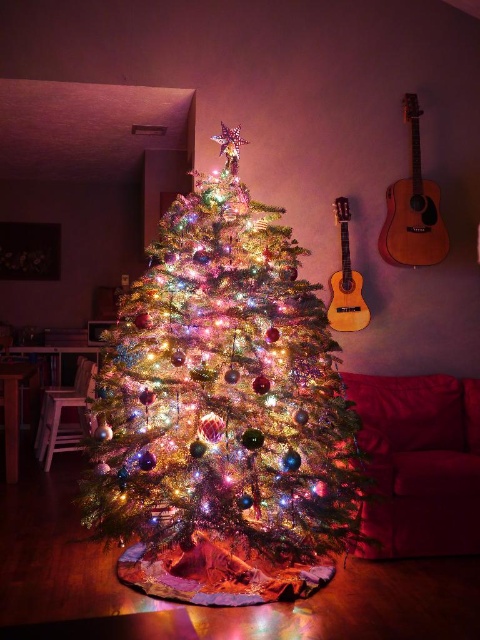
You are helping to arrange decorations in the room with the Christmas tree. You need to hang a large ornament that requires more space between the guitars. Which guitar should you choose to place it above, the wooden acoustic guitar at right or the light brown wooden guitar at right?

The wooden acoustic guitar at right is bigger than the light brown wooden guitar at right, so you should place the large ornament above the wooden acoustic guitar at right since it provides more space.